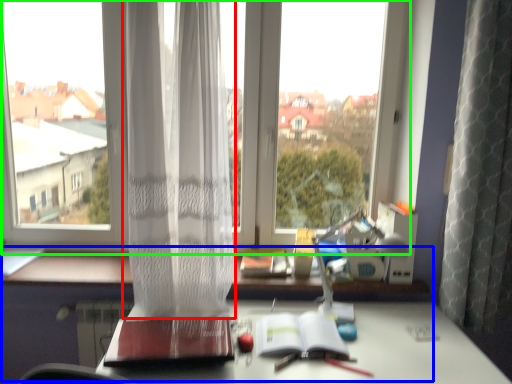
Question: Which is farther away from curtain (highlighted by a red box)? computer desk (highlighted by a blue box) or window (highlighted by a green box)?

Choices:
 (A) computer desk
 (B) window

Answer: (A)